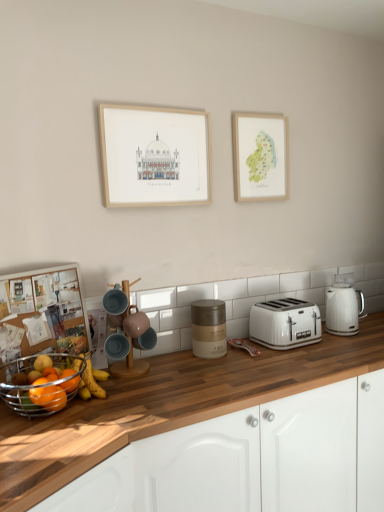
Locate an element on the screen. The height and width of the screenshot is (512, 384). vacant area located to the right-hand side of matte ceramic coffee machine at center is located at coordinates (173, 370).